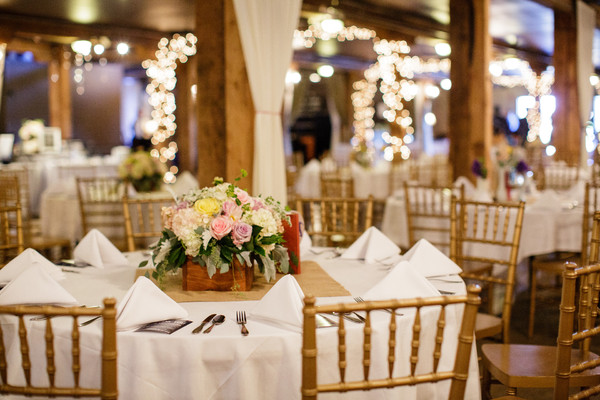
Locate an element on the screen. Image resolution: width=600 pixels, height=400 pixels. square wooden pillar is located at coordinates (220, 100), (474, 94), (569, 94).